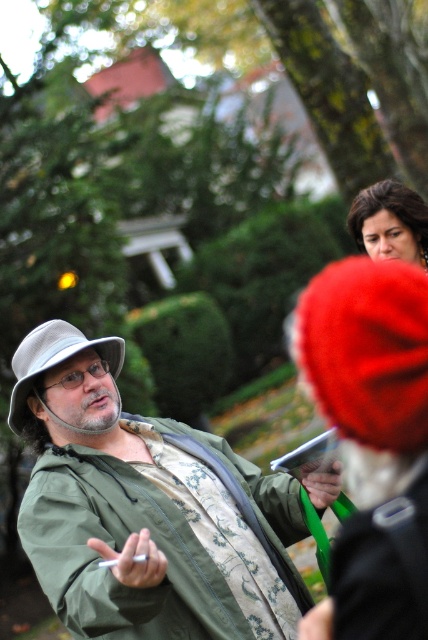
You are standing in the park scene and want to take a photo. You have two points marked in the image, point (207, 445) and point (410, 323). Which point is closer to your camera lens?

Point (410, 323) is closer to the camera lens because it is less further than point (207, 445).

You are standing in the park and see two hats in the image. The red fuzzy Christmas hat at upper right and the gray fabric hat at left. Which hat is positioned more to the right side of the image?

The red fuzzy Christmas hat at upper right is positioned more to the right side of the image than the gray fabric hat at left.

You are a photographer trying to capture a photo of the green matte jacket at center and the red fuzzy christmas hat at upper right. Based on their positions, which object should you focus on first to ensure both are in the frame?

The green matte jacket at center is located below the red fuzzy christmas hat at upper right, so you should focus on the red fuzzy christmas hat at upper right first to ensure both are in the frame.